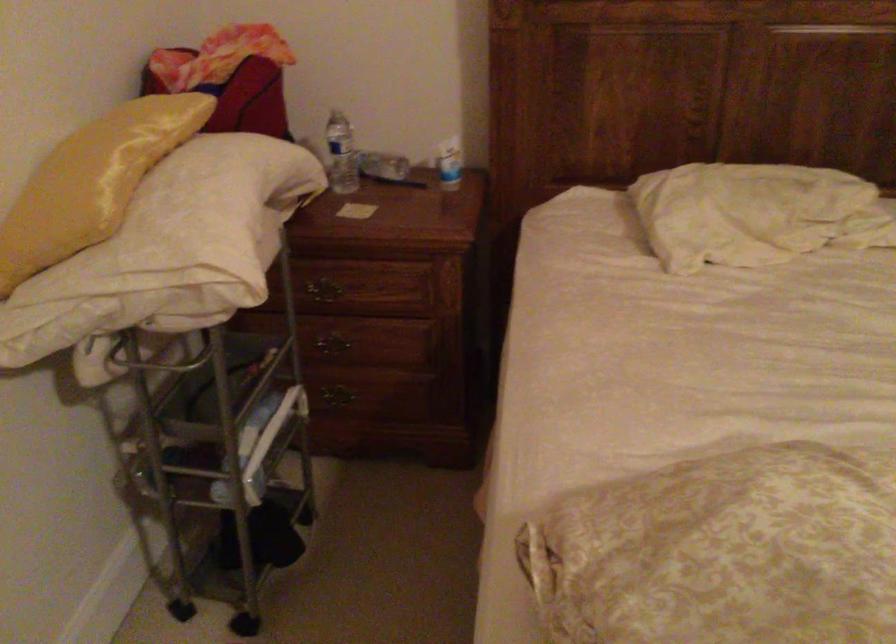
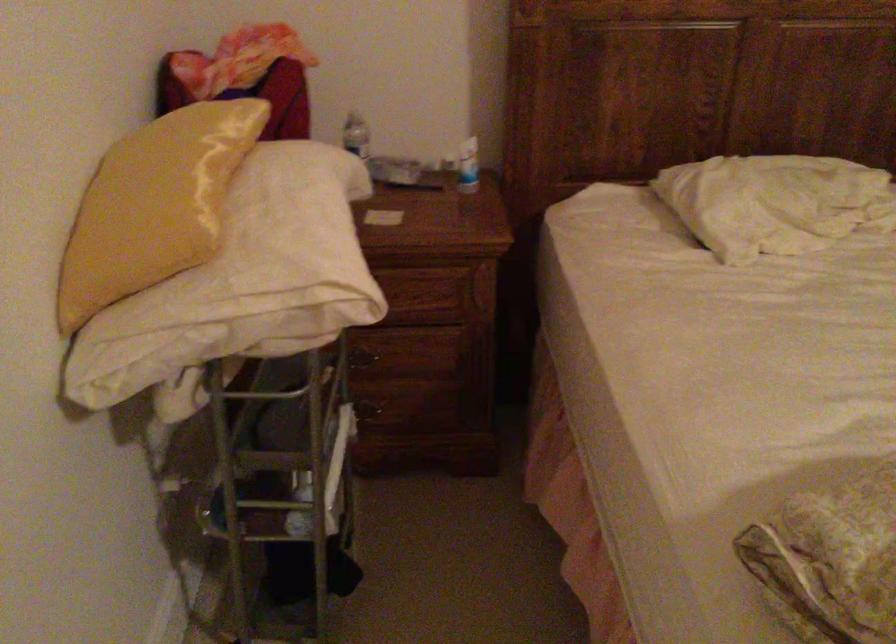
In the second image, find the point that corresponds to [69,185] in the first image.

(153, 205)